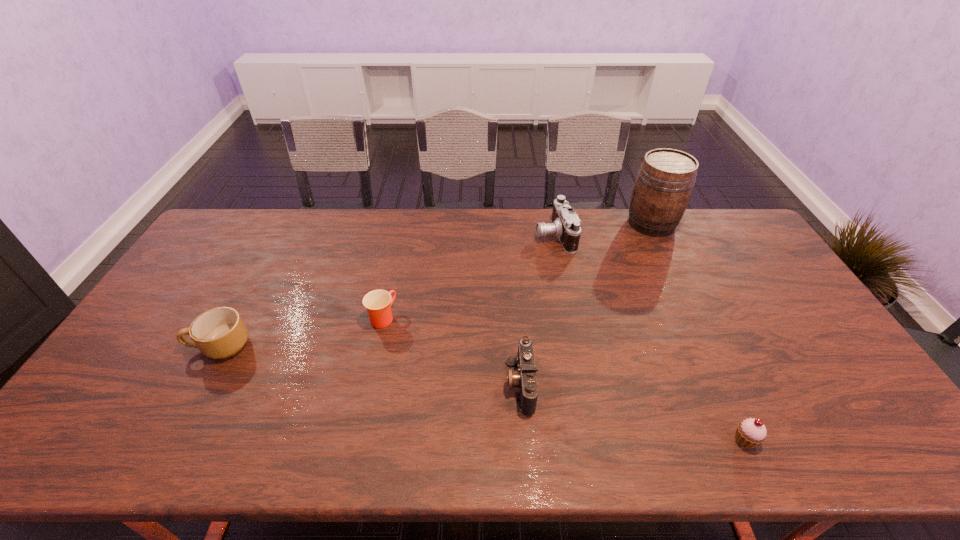
Select which object appears as the closest to the tallest object. Please provide its 2D coordinates. Your answer should be formatted as a tuple, i.e. [(x, y)], where the tuple contains the x and y coordinates of a point satisfying the conditions above.

[(565, 225)]

Find the location of a particular element. free region that satisfies the following two spatial constraints: 1. on the front side of the cup; 2. on the left side of the cupcake is located at coordinates (356, 440).

The image size is (960, 540). Find the location of `free location that satisfies the following two spatial constraints: 1. on the front-facing side of the shorter camera; 2. on the right side of the cupcake`. free location that satisfies the following two spatial constraints: 1. on the front-facing side of the shorter camera; 2. on the right side of the cupcake is located at coordinates (525, 440).